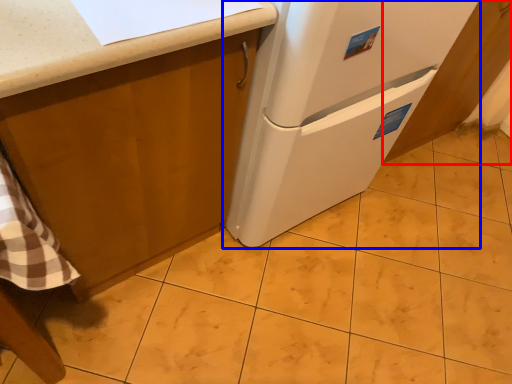
Question: Which point is further to the camera, cabinetry (highlighted by a red box) or refrigerator (highlighted by a blue box)?

Choices:
 (A) cabinetry
 (B) refrigerator

Answer: (A)